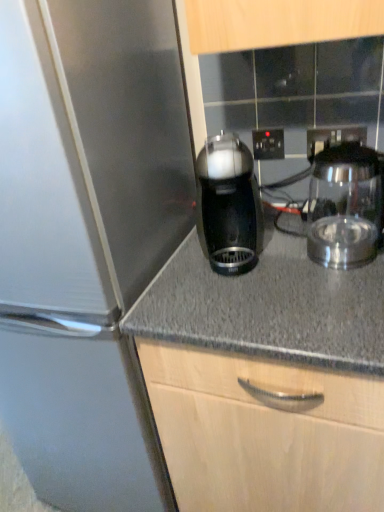
Question: Can you confirm if transparent glass carafe at right, the first kitchen appliance from the right, is shorter than black plastic electric outlet at center, the second electric outlet positioned from the front?

Choices:
 (A) yes
 (B) no

Answer: (B)

Question: From a real-world perspective, is transparent glass carafe at right, the first kitchen appliance from the right, physically below black plastic electric outlet at center, the second electric outlet positioned from the front?

Choices:
 (A) yes
 (B) no

Answer: (A)

Question: From the image's perspective, does transparent glass carafe at right, the first kitchen appliance from the right, appear lower than black plastic electric outlet at center, which appears as the second electric outlet when viewed from the right?

Choices:
 (A) yes
 (B) no

Answer: (A)

Question: Is transparent glass carafe at right, the first kitchen appliance from the right, positioned in front of black plastic electric outlet at center, which is the 1th electric outlet in back-to-front order?

Choices:
 (A) no
 (B) yes

Answer: (B)

Question: Is transparent glass carafe at right, the first kitchen appliance from the right, at the left side of black plastic electric outlet at center, which ranks as the 1th electric outlet in left-to-right order?

Choices:
 (A) no
 (B) yes

Answer: (A)

Question: Can you confirm if transparent glass carafe at right, the 2th kitchen appliance in the left-to-right sequence, is taller than black plastic electric outlet at center, which appears as the second electric outlet when viewed from the right?

Choices:
 (A) yes
 (B) no

Answer: (A)

Question: From a real-world perspective, is black plastic electric outlet at upper center, which appears as the second electric outlet when viewed from the left, below transparent glass carafe at right, the first kitchen appliance from the right?

Choices:
 (A) yes
 (B) no

Answer: (B)

Question: From the image's perspective, is black plastic electric outlet at upper center, which appears as the second electric outlet when viewed from the back, located beneath transparent glass carafe at right, the 2th kitchen appliance in the left-to-right sequence?

Choices:
 (A) no
 (B) yes

Answer: (A)

Question: From a real-world perspective, is black plastic electric outlet at upper center, which is the first electric outlet from right to left, positioned over transparent glass carafe at right, the first kitchen appliance from the right, based on gravity?

Choices:
 (A) yes
 (B) no

Answer: (A)

Question: Does black plastic electric outlet at upper center, which appears as the second electric outlet when viewed from the back, have a lesser height compared to transparent glass carafe at right, the first kitchen appliance from the right?

Choices:
 (A) no
 (B) yes

Answer: (B)

Question: Is black plastic electric outlet at upper center, which is the first electric outlet from right to left, thinner than transparent glass carafe at right, the first kitchen appliance from the right?

Choices:
 (A) yes
 (B) no

Answer: (A)

Question: Considering the relative sizes of black plastic electric outlet at upper center, which is the first electric outlet from right to left, and transparent glass carafe at right, the first kitchen appliance from the right, in the image provided, is black plastic electric outlet at upper center, which is the first electric outlet from right to left, bigger than transparent glass carafe at right, the first kitchen appliance from the right,?

Choices:
 (A) yes
 (B) no

Answer: (B)

Question: Is black plastic electric outlet at center, which is the 1th electric outlet in back-to-front order, in contact with black plastic electric outlet at upper center, which appears as the second electric outlet when viewed from the back?

Choices:
 (A) no
 (B) yes

Answer: (A)